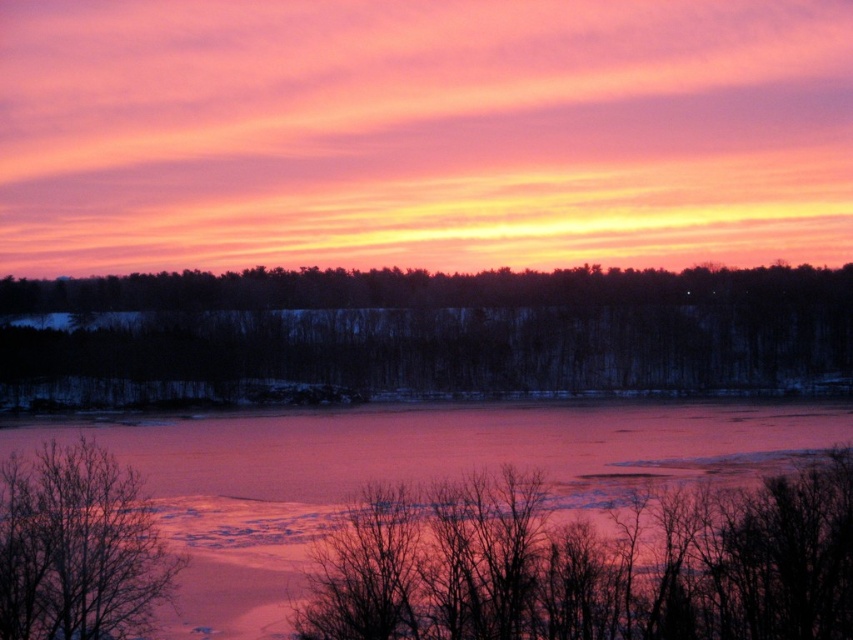
Is point (498, 340) behind point (25, 448)?

Yes, it is.

Is dark brown bark at center positioned at the back of pink ice at center?

Yes.

Measure the distance between point (x=312, y=380) and camera.

Point (x=312, y=380) and camera are 405.34 feet apart from each other.

Locate an element on the screen. The width and height of the screenshot is (853, 640). dark brown bark at center is located at coordinates (427, 333).

Is pink ice at center thinner than bare branches at lower left?

No, pink ice at center is not thinner than bare branches at lower left.

Can you confirm if pink ice at center is positioned to the left of bare branches at lower left?

Indeed, pink ice at center is positioned on the left side of bare branches at lower left.

Who is more distant from viewer, (148, 481) or (35, 561)?

Positioned behind is point (148, 481).

Where is `pink ice at center`? The height and width of the screenshot is (640, 853). pink ice at center is located at coordinates (399, 468).

Can you confirm if dark brown bark at center is positioned below bare branches at lower left?

Actually, dark brown bark at center is above bare branches at lower left.

Does dark brown bark at center have a lesser width compared to bare branches at lower left?

Incorrect, dark brown bark at center's width is not less than bare branches at lower left's.

Does point (364, 336) lie in front of point (84, 612)?

No, it is behind (84, 612).

Locate an element on the screen. dark brown bark at center is located at coordinates (427, 333).